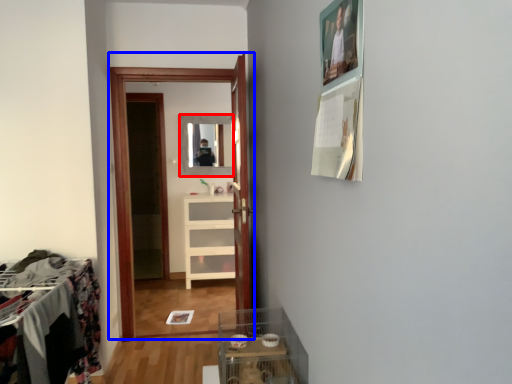
Question: Which object is further to the camera taking this photo, mirror (highlighted by a red box) or clothing store (highlighted by a blue box)?

Choices:
 (A) mirror
 (B) clothing store

Answer: (A)